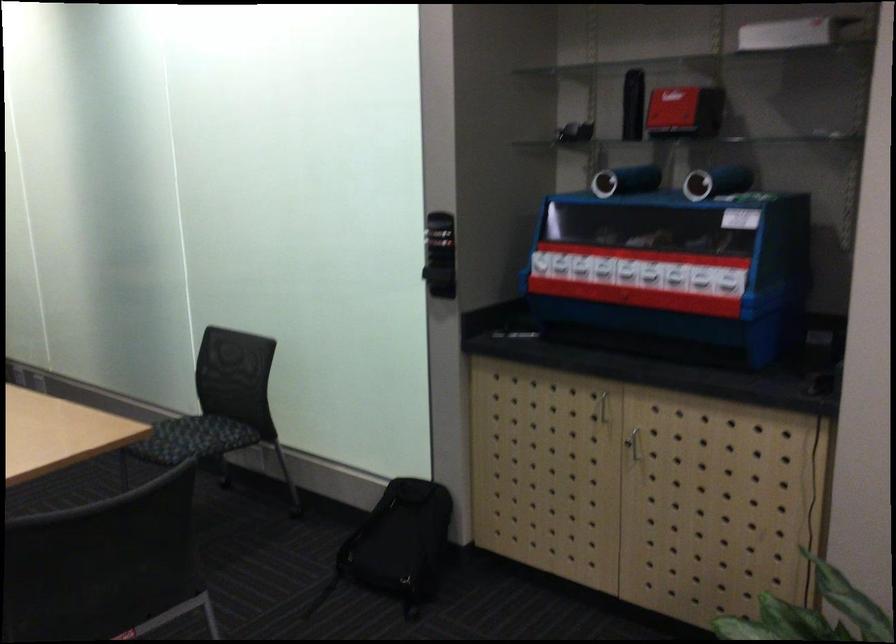
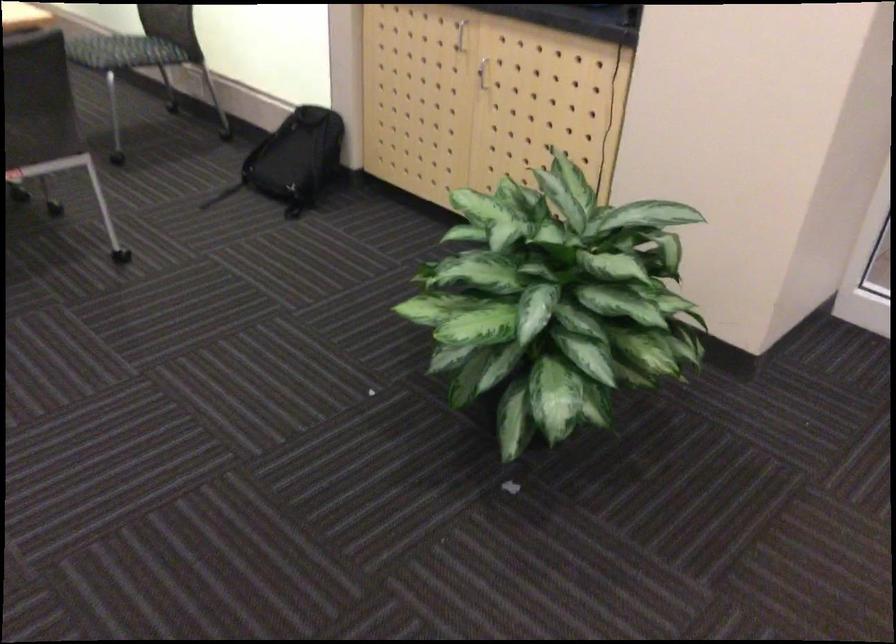
Where in the second image is the point corresponding to the point at 410,545 from the first image?

(293, 160)